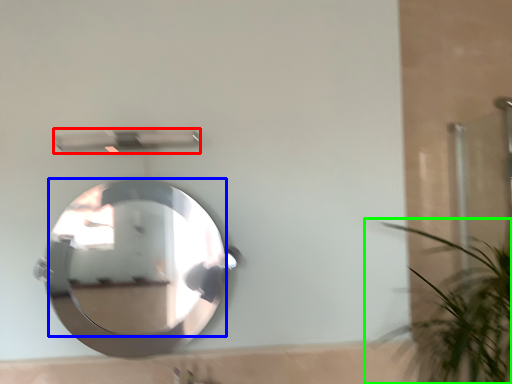
Question: Which is farther away from shower (highlighted by a red box)? mirror (highlighted by a blue box) or houseplant (highlighted by a green box)?

Choices:
 (A) mirror
 (B) houseplant

Answer: (A)